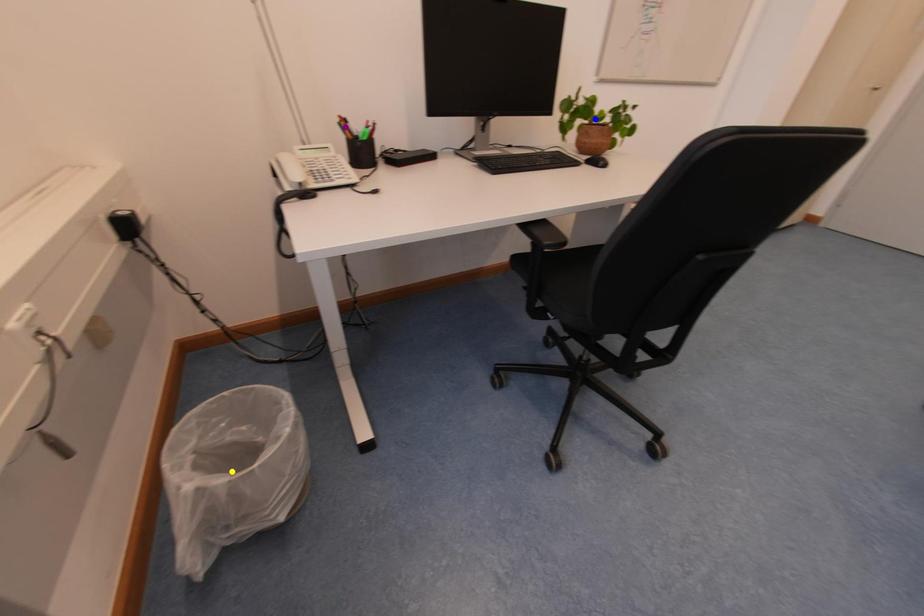
Order these from nearest to farthest:
purple point
blue point
yellow point

blue point → purple point → yellow point